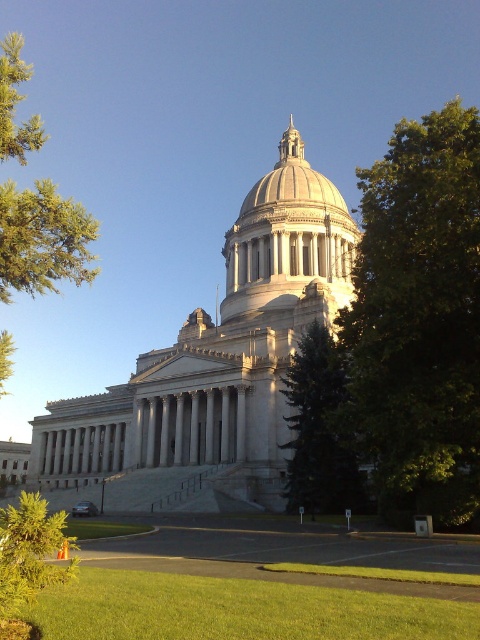
Can you confirm if green textured tree at center is positioned below green textured tree at lower left?

Actually, green textured tree at center is above green textured tree at lower left.

Does point (321, 492) lie in front of point (26, 544)?

No.

Where is `green textured tree at center`? Image resolution: width=480 pixels, height=640 pixels. green textured tree at center is located at coordinates (321, 429).

Does green grass at lower center appear over green leafy tree at lower left?

Actually, green grass at lower center is below green leafy tree at lower left.

Who is higher up, green grass at lower center or green leafy tree at lower left?

green leafy tree at lower left is above.

Identify the location of green grass at lower center. Image resolution: width=480 pixels, height=640 pixels. (237, 611).

Is green grass at lower center positioned before green textured tree at lower left?

Yes, green grass at lower center is in front of green textured tree at lower left.

Which is more to the right, green grass at lower center or green textured tree at lower left?

green grass at lower center

Measure the distance between green grass at lower center and camera.

green grass at lower center is 23.71 meters away from camera.

At what (x,y) coordinates should I click in order to perform the action: click on green grass at lower center. Please return your answer as a coordinate pair (x, y). This screenshot has width=480, height=640. Looking at the image, I should click on (237, 611).